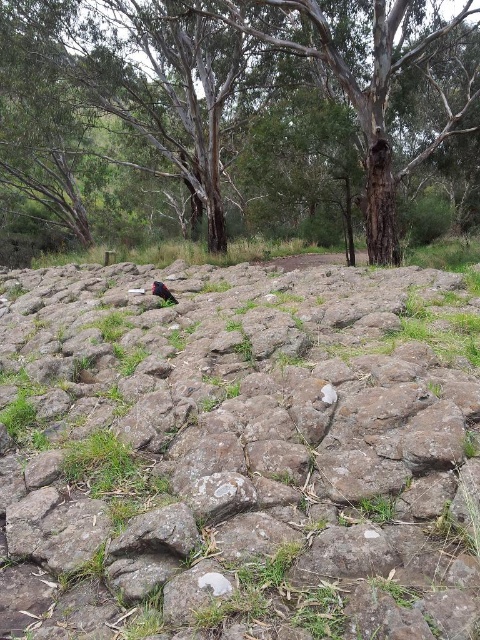
You are standing in the rocky terrain and want to take a photo of the shiny black bird at center without the rough textured rock at center blocking the view. Is this possible?

The rough textured rock at center is in front of the shiny black bird at center, so it will block the view. Move to a different angle to avoid the rock.